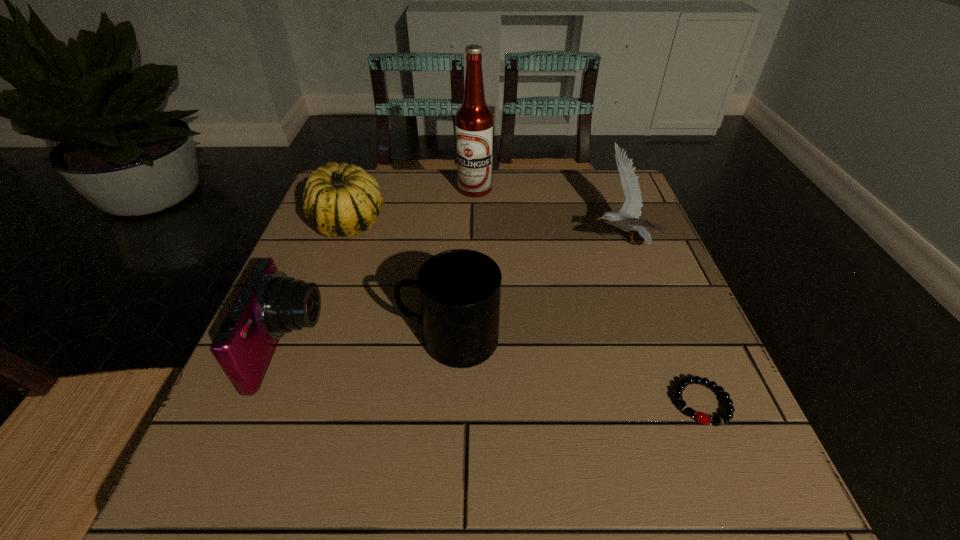
The image size is (960, 540). Identify the location of the tallest object. (474, 121).

This screenshot has width=960, height=540. I want to click on alcohol, so click(x=474, y=121).

Find the location of a particular element. This screenshot has height=540, width=960. gull is located at coordinates (627, 219).

This screenshot has width=960, height=540. Find the location of `mug`. mug is located at coordinates (459, 289).

Identify the location of gourd. (339, 200).

You are a GUI agent. You are given a task and a screenshot of the screen. Output one action in this format:
    pyautogui.click(x=<x>, y=<y>)
    Task: Click on the camera
    The image size is (960, 540).
    Given the screenshot: What is the action you would take?
    pyautogui.click(x=270, y=304)

Identify the location of bracelet. (701, 417).

The height and width of the screenshot is (540, 960). I want to click on free space located on the label side of the alcohol, so click(473, 301).

Find the location of a particular element. The height and width of the screenshot is (540, 960). vacant space located 0.240m at the tip of the beak of the gull is located at coordinates (487, 243).

I want to click on free spot located at the tip of the beak of the gull, so click(x=492, y=243).